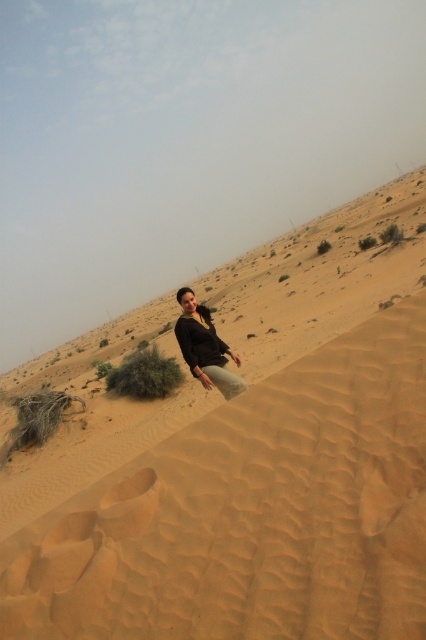
You are a photographer planning to take a picture of the sandy textured desert at center and the matte black top at center. Based on their positions, which object should you focus on first if you want to capture both in a single frame without moving the camera?

The matte black top at center should be focused on first because the sandy textured desert at center is positioned to its right, meaning they are both within the same frame. However, since the person is seated at the edge of the dune, ensuring the matte black top at center is in focus will naturally include the sandy textured desert at center in the background or adjacent area, depending on the camera settings.